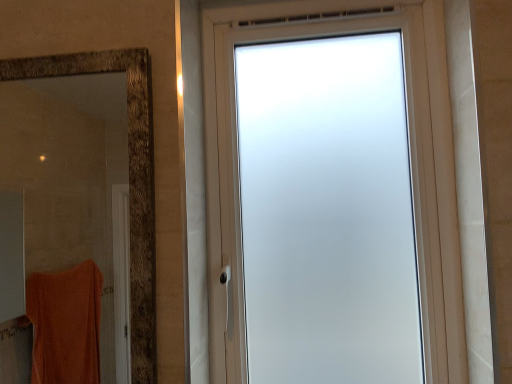
Question: From the image's perspective, is brown textured mirror at left positioned above or below frosted glass window at center?

Choices:
 (A) below
 (B) above

Answer: (A)

Question: Considering the positions of brown textured mirror at left and frosted glass window at center in the image, is brown textured mirror at left wider or thinner than frosted glass window at center?

Choices:
 (A) wide
 (B) thin

Answer: (B)

Question: Is brown textured mirror at left taller or shorter than frosted glass window at center?

Choices:
 (A) tall
 (B) short

Answer: (B)

Question: Is frosted glass window at center situated inside brown textured mirror at left or outside?

Choices:
 (A) inside
 (B) outside

Answer: (B)

Question: Is frosted glass window at center to the left or to the right of brown textured mirror at left in the image?

Choices:
 (A) right
 (B) left

Answer: (A)

Question: Based on their sizes in the image, would you say frosted glass window at center is bigger or smaller than brown textured mirror at left?

Choices:
 (A) big
 (B) small

Answer: (A)

Question: In terms of height, does frosted glass window at center look taller or shorter compared to brown textured mirror at left?

Choices:
 (A) short
 (B) tall

Answer: (B)